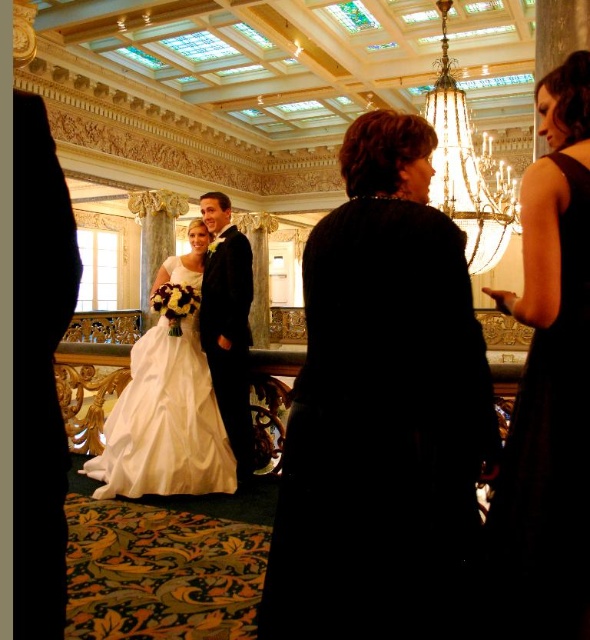
Question: Is dark velvet dress at center above shiny black suit at center?

Choices:
 (A) yes
 (B) no

Answer: (B)

Question: Based on their relative distances, which object is nearer to the shiny black suit at center?

Choices:
 (A) white satin dress at center
 (B) black satin dress at right

Answer: (A)

Question: Which of these objects is positioned closest to the dark velvet dress at center?

Choices:
 (A) shiny black suit at center
 (B) white satin dress at center
 (C) gold crystal chandelier at upper center
 (D) black satin dress at right

Answer: (D)

Question: Is black satin dress at right further to the viewer compared to gold crystal chandelier at upper center?

Choices:
 (A) yes
 (B) no

Answer: (B)

Question: Among these points, which one is nearest to the camera?

Choices:
 (A) (211, 321)
 (B) (480, 259)

Answer: (A)

Question: Does dark velvet dress at center have a smaller size compared to shiny black suit at center?

Choices:
 (A) no
 (B) yes

Answer: (A)